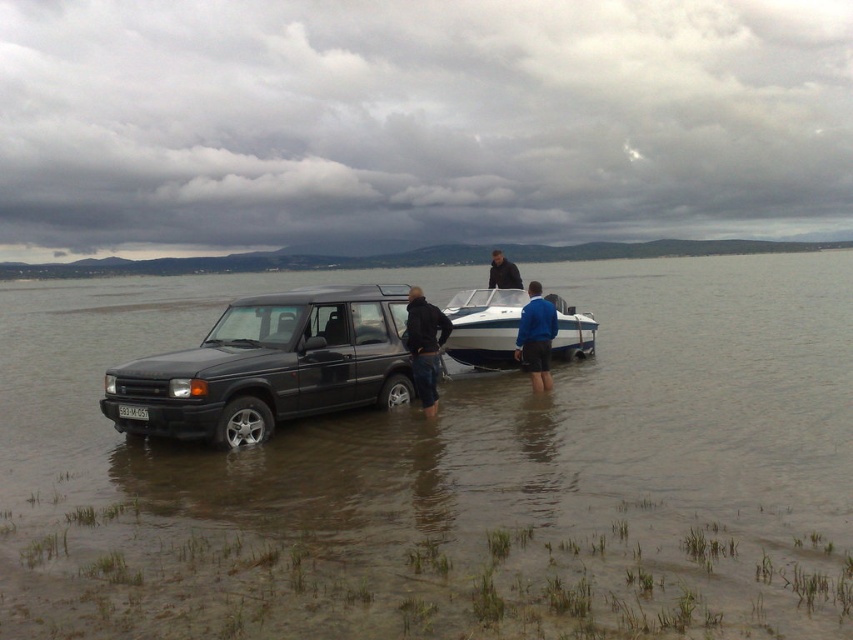
Based on the photo, can you confirm if clear water at center is positioned to the left of matte black suv at center?

In fact, clear water at center is to the right of matte black suv at center.

Between clear water at center and matte black suv at center, which one appears on the right side from the viewer's perspective?

Positioned to the right is clear water at center.

Where is `clear water at center`? The height and width of the screenshot is (640, 853). clear water at center is located at coordinates (448, 474).

In the scene shown: Does matte black suv at center appear under white plastic license plate at center?

No, matte black suv at center is not below white plastic license plate at center.

Where is `matte black suv at center`? matte black suv at center is located at coordinates (271, 365).

This screenshot has height=640, width=853. Find the location of `matte black suv at center`. matte black suv at center is located at coordinates (271, 365).

Is the position of white glossy boat at center more distant than that of blue fabric jacket at center?

That is True.

Is point (477, 362) farther from camera compared to point (538, 324)?

Yes, point (477, 362) is farther from viewer.

Where is `white glossy boat at center`? white glossy boat at center is located at coordinates (485, 326).

The height and width of the screenshot is (640, 853). Identify the location of white glossy boat at center. (485, 326).